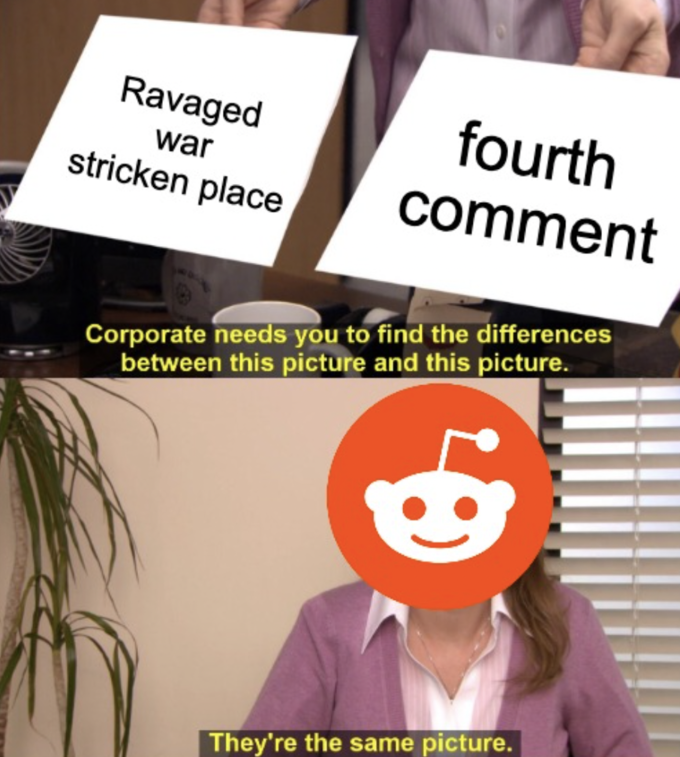
The height and width of the screenshot is (757, 680). What are the coordinates of `fan` in the screenshot? It's located at (20, 245).